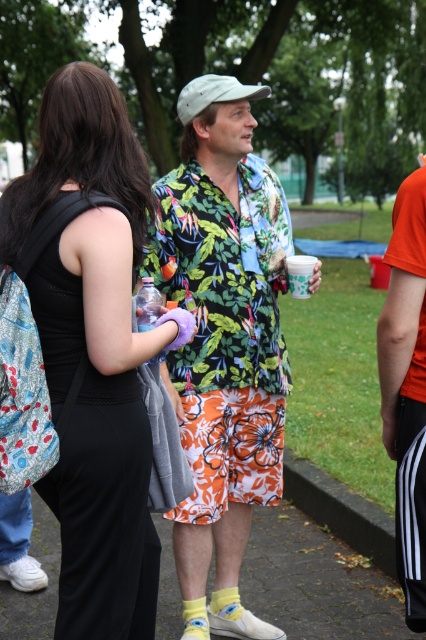
Does point (271, 360) come closer to viewer compared to point (250, 90)?

No, it is behind (250, 90).

In the scene shown: Is floral print shirt at center positioned at the back of light gray fabric baseball cap at upper center?

No.

Find the location of `floral print shirt at center`. floral print shirt at center is located at coordinates (222, 342).

Who is more forward, (158, 550) or (241, 492)?

Point (158, 550) is in front.

Who is positioned more to the left, black fabric dress at center or floral print shirt at center?

From the viewer's perspective, black fabric dress at center appears more on the left side.

From the picture: Who is more forward, (106, 115) or (227, 163)?

Positioned in front is point (106, 115).

The height and width of the screenshot is (640, 426). I want to click on black fabric dress at center, so click(94, 353).

Based on the photo, between black fabric dress at center and light gray fabric baseball cap at upper center, which one appears on the right side from the viewer's perspective?

light gray fabric baseball cap at upper center

Is black fabric dress at center below light gray fabric baseball cap at upper center?

Correct, black fabric dress at center is located below light gray fabric baseball cap at upper center.

Which is behind, point (106, 568) or point (244, 93)?

Point (244, 93)

Where is `black fabric dress at center`? The height and width of the screenshot is (640, 426). black fabric dress at center is located at coordinates 94,353.